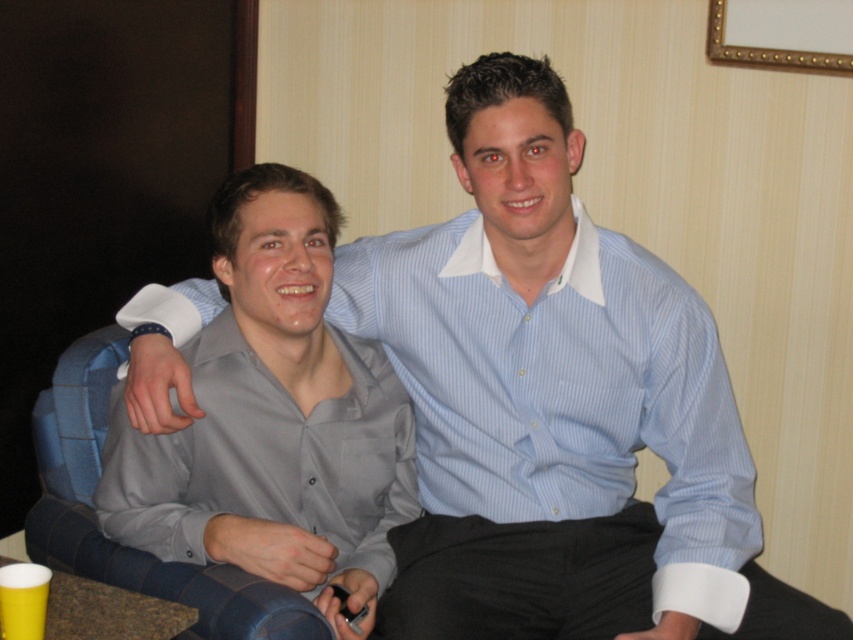
Question: Can you confirm if matte gray shirt at center is positioned to the right of gold metallic picture frame at upper right?

Choices:
 (A) yes
 (B) no

Answer: (B)

Question: Among these objects, which one is nearest to the camera?

Choices:
 (A) matte gray shirt at center
 (B) gold metallic picture frame at upper right

Answer: (A)

Question: Does matte gray shirt at center have a larger size compared to gold metallic picture frame at upper right?

Choices:
 (A) no
 (B) yes

Answer: (B)

Question: Among these objects, which one is farthest from the camera?

Choices:
 (A) gold metallic picture frame at upper right
 (B) matte gray shirt at center

Answer: (A)

Question: Does matte gray shirt at center appear on the right side of gold metallic picture frame at upper right?

Choices:
 (A) yes
 (B) no

Answer: (B)

Question: Among these points, which one is farthest from the camera?

Choices:
 (A) pyautogui.click(x=755, y=4)
 (B) pyautogui.click(x=189, y=442)

Answer: (A)